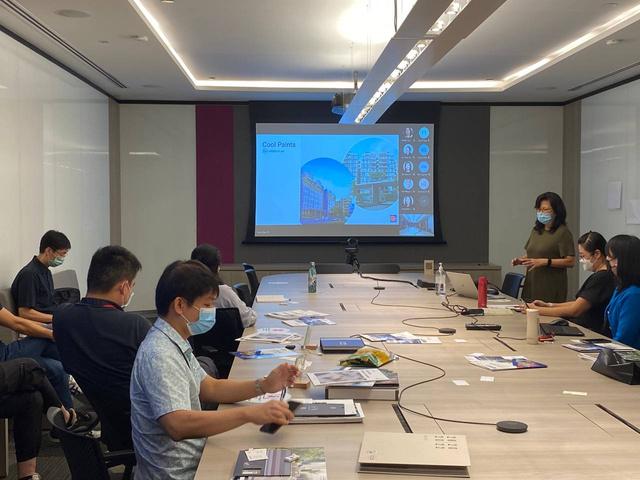
Find the location of a particular element. The image size is (640, 480). projector screen is located at coordinates (372, 207).